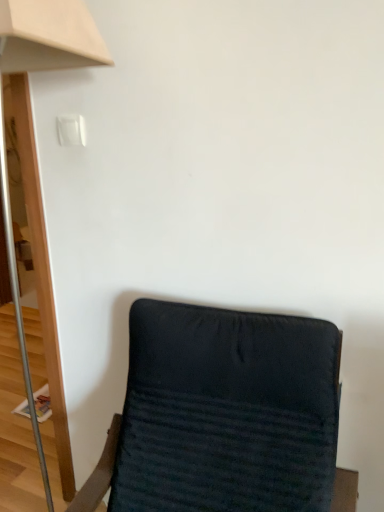
Locate an element on the screen. The image size is (384, 512). black fabric chair at lower right is located at coordinates (222, 414).

This screenshot has width=384, height=512. Describe the element at coordinates (222, 414) in the screenshot. I see `black fabric chair at lower right` at that location.

This screenshot has height=512, width=384. In order to click on black fabric chair at lower right in this screenshot , I will do `click(222, 414)`.